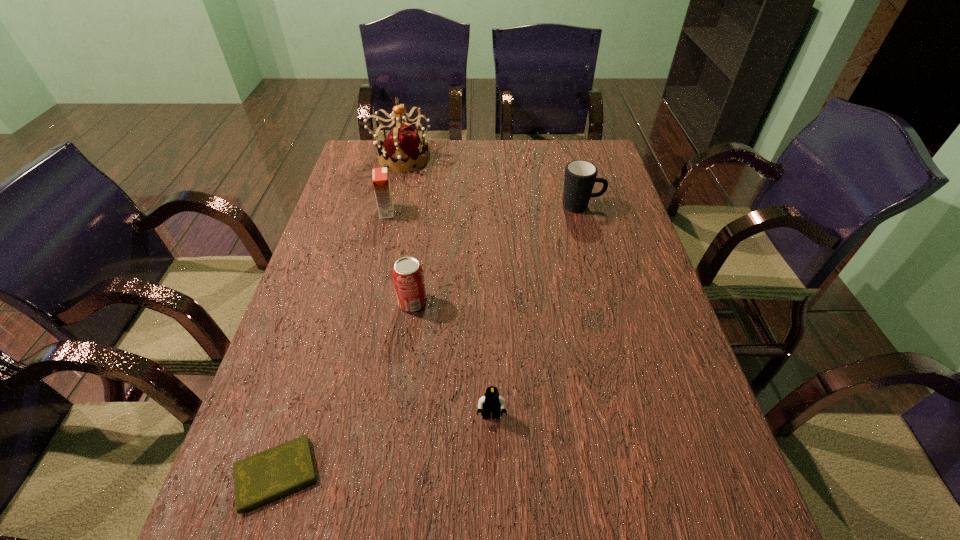
Identify the location of object that is at the far left corner. (402, 145).

In order to click on vacant area at the far edge of the desktop in this screenshot , I will do `click(467, 172)`.

At what (x,y) coordinates should I click in order to perform the action: click on free region at the left edge of the desktop. Please return your answer as a coordinate pair (x, y). The image size is (960, 540). Looking at the image, I should click on (289, 339).

Where is `vacant region at the right edge of the desktop`? vacant region at the right edge of the desktop is located at coordinates (617, 228).

This screenshot has width=960, height=540. I want to click on vacant area at the far left corner, so point(350,164).

Where is `blank region between the shortest object and the tallest object`? Image resolution: width=960 pixels, height=540 pixels. blank region between the shortest object and the tallest object is located at coordinates (339, 316).

This screenshot has height=540, width=960. I want to click on free point between the tiara and the rightmost object, so click(x=492, y=182).

Identify the location of vacant space that is in between the mug and the soda can. Image resolution: width=960 pixels, height=540 pixels. (497, 254).

Where is `free space that is in between the diary and the rightmost object`? This screenshot has width=960, height=540. free space that is in between the diary and the rightmost object is located at coordinates (429, 340).

The width and height of the screenshot is (960, 540). What are the coordinates of `empty location between the diary and the fourth farthest object` in the screenshot? It's located at (345, 388).